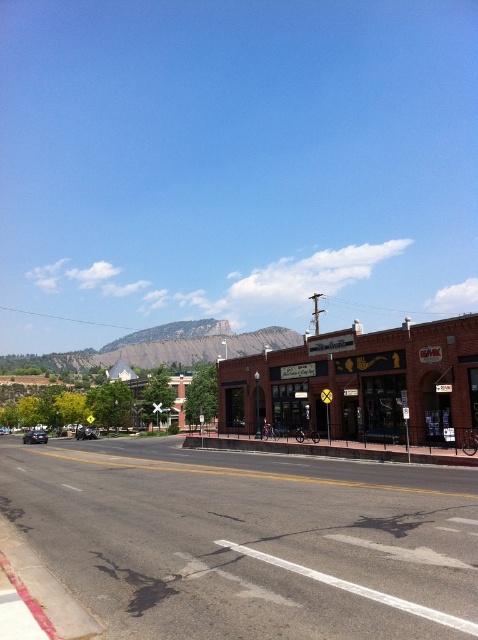
You are standing at the crosswalk on the road and want to reach the brown brick building at center. Which direction should you head towards?

The brown brick building at center is located at point (107, 401), so you should head towards the direction where the coordinates increase in the x and y axes to reach it.

In the scene shown: You are driving a delivery van that is 20 feet long. You need to make a U turn on the road between the brick building at center and the shiny black sedan at left. Is there enough space for your van to complete the U turn without moving either vehicle?

The distance between the brick building at center and the shiny black sedan at left is 115.79 feet. Since your van is 20 feet long, you need at least twice its length, which is 40 feet, for a safe U turn. The available space of 115.79 feet is more than sufficient, so yes, there is enough space to complete the U turn.